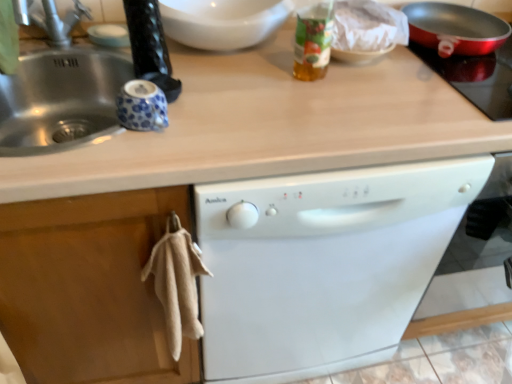
At what (x,y) coordinates should I click in order to perform the action: click on vacant area in front of translucent plastic bottle at upper center. Please return your answer as a coordinate pair (x, y). The image size is (512, 384). Looking at the image, I should click on (312, 112).